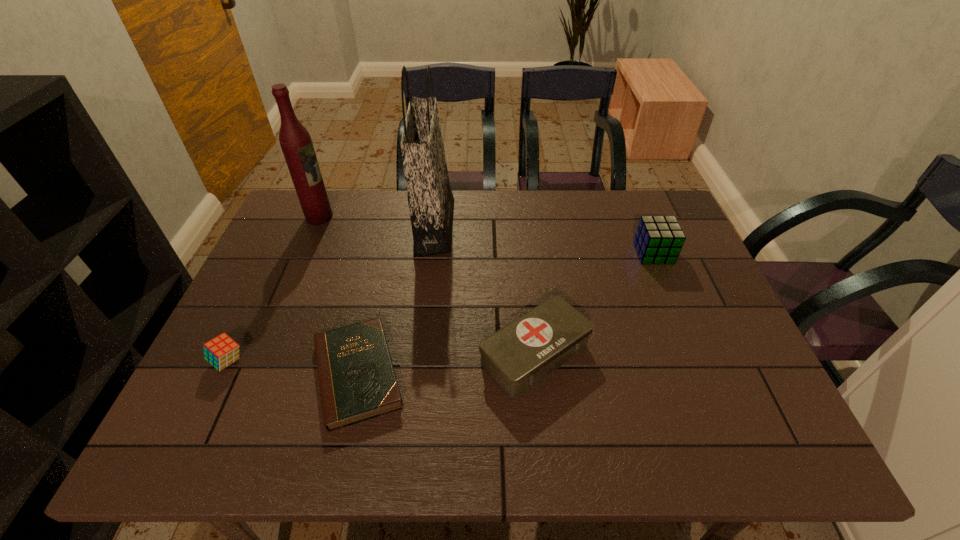
This screenshot has width=960, height=540. What are the coordinates of `vacant area in the image that satisfies the following two spatial constraints: 1. on the label of the taller cube; 2. on the right side of the liquor` in the screenshot? It's located at tap(304, 253).

Locate an element on the screen. The image size is (960, 540). vacant space that satisfies the following two spatial constraints: 1. on the label of the farther cube; 2. on the left side of the liquor is located at coordinates (304, 253).